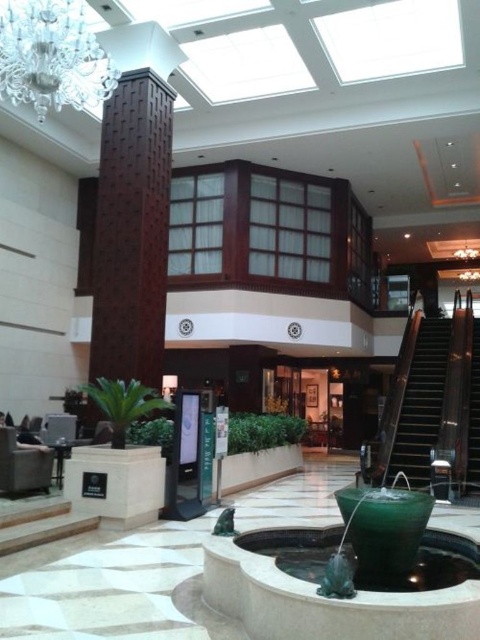
You are standing in the lobby and want to admire the crystal glass chandelier at upper left. If your maximum reach is 1.8 meters, can you touch it without any assistance?

The crystal glass chandelier at upper left is 5.91 meters away from the viewer. Since your maximum reach is only 1.8 meters, you cannot touch it without assistance.

You are standing in the lobby of this upscale building and want to locate the green marble fountain at center. Which direction should you look relative to the crystal glass chandelier at upper left?

The green marble fountain at center is located below the crystal glass chandelier at upper left, so you should look downward from the chandelier to find the fountain.